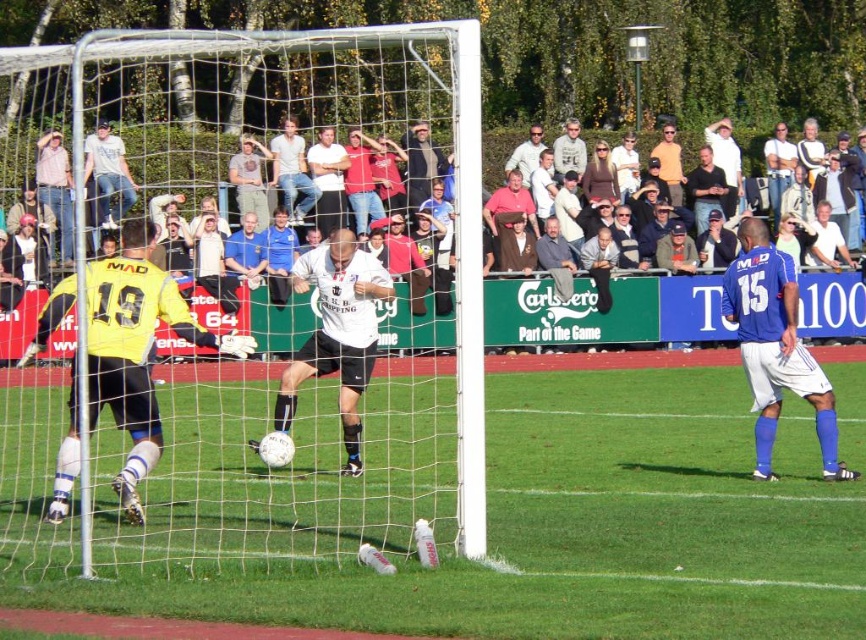
In the scene shown: Is white mesh net at center in front of white matte jersey at center?

Yes, white mesh net at center is in front of white matte jersey at center.

Which of these two, white mesh net at center or white matte jersey at center, stands taller?

Standing taller between the two is white mesh net at center.

Where is `white mesh net at center`? The height and width of the screenshot is (640, 866). white mesh net at center is located at coordinates (228, 310).

Is point (13, 436) closer to viewer compared to point (309, 618)?

No, (13, 436) is behind (309, 618).

Image resolution: width=866 pixels, height=640 pixels. I want to click on white mesh net at center, so click(228, 310).

At what (x,y) coordinates should I click in order to perform the action: click on white mesh net at center. Please return your answer as a coordinate pair (x, y). The height and width of the screenshot is (640, 866). Looking at the image, I should click on (228, 310).

Is the position of green grass at center more distant than that of blue jersey at right?

No, it is in front of blue jersey at right.

Who is higher up, green grass at center or blue jersey at right?

Positioned higher is blue jersey at right.

Which is behind, point (718, 355) or point (753, 253)?

Point (718, 355)

In order to click on green grass at center in this screenshot , I will do `click(589, 528)`.